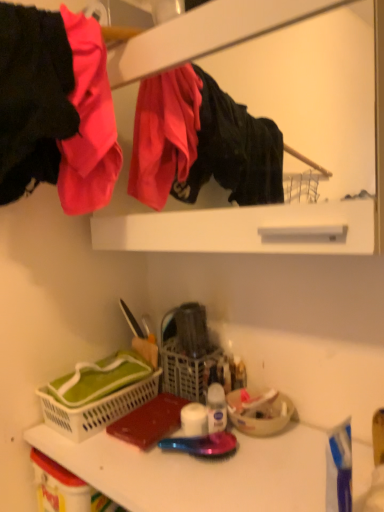
Question: Which direction should I rotate to look at matte white medicine cabinet at upper center?

Choices:
 (A) right
 (B) left

Answer: (A)

Question: Considering the relative sizes of transparent plastic spray bottle at center and white matte toilet paper at center in the image provided, is transparent plastic spray bottle at center thinner than white matte toilet paper at center?

Choices:
 (A) yes
 (B) no

Answer: (A)

Question: Could white matte toilet paper at center be considered to be inside transparent plastic spray bottle at center?

Choices:
 (A) no
 (B) yes

Answer: (A)

Question: Is transparent plastic spray bottle at center positioned with its back to white matte toilet paper at center?

Choices:
 (A) yes
 (B) no

Answer: (B)

Question: Considering the relative positions of transparent plastic spray bottle at center and white matte toilet paper at center in the image provided, is transparent plastic spray bottle at center in front of white matte toilet paper at center?

Choices:
 (A) no
 (B) yes

Answer: (B)

Question: From a real-world perspective, is transparent plastic spray bottle at center over white matte toilet paper at center?

Choices:
 (A) no
 (B) yes

Answer: (B)

Question: Could you tell me if transparent plastic spray bottle at center is facing white matte toilet paper at center?

Choices:
 (A) yes
 (B) no

Answer: (B)

Question: From the image's perspective, is white plastic counter top at lower center below matte black jacket at upper left?

Choices:
 (A) no
 (B) yes

Answer: (B)

Question: Can matte black jacket at upper left be found inside white plastic counter top at lower center?

Choices:
 (A) yes
 (B) no

Answer: (B)

Question: Does white plastic counter top at lower center have a lesser height compared to matte black jacket at upper left?

Choices:
 (A) no
 (B) yes

Answer: (B)

Question: Can you confirm if white plastic counter top at lower center is thinner than matte black jacket at upper left?

Choices:
 (A) no
 (B) yes

Answer: (A)

Question: Is white plastic counter top at lower center wider than matte black jacket at upper left?

Choices:
 (A) no
 (B) yes

Answer: (B)

Question: Does white plastic counter top at lower center have a larger size compared to matte black jacket at upper left?

Choices:
 (A) yes
 (B) no

Answer: (B)

Question: Would you say white plastic basket at lower left is outside white matte toilet paper at center?

Choices:
 (A) yes
 (B) no

Answer: (A)